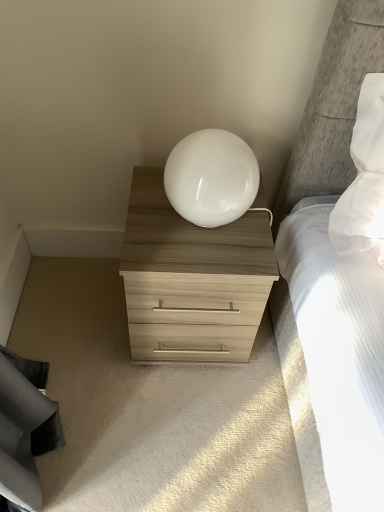
This screenshot has width=384, height=512. I want to click on free region under white glossy sphere at center (from a real-world perspective), so click(203, 228).